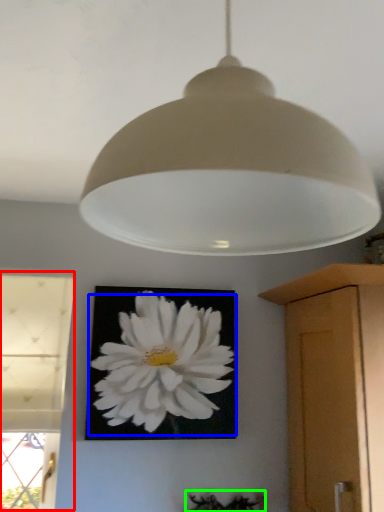
Question: Based on their relative distances, which object is farther from window (highlighted by a red box)? Choose from flower (highlighted by a blue box) and plant (highlighted by a green box).

Choices:
 (A) flower
 (B) plant

Answer: (B)